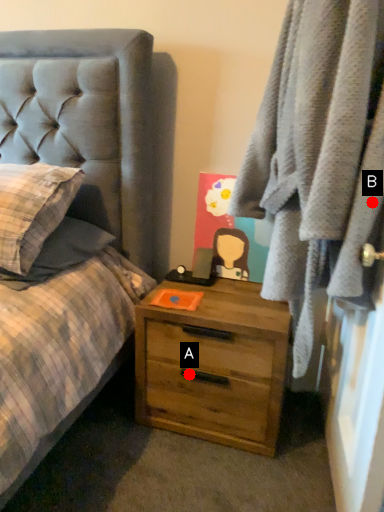
Question: Two points are circled on the image, labeled by A and B beside each circle. Which point is farther to the camera?

Choices:
 (A) A is further
 (B) B is further

Answer: (A)